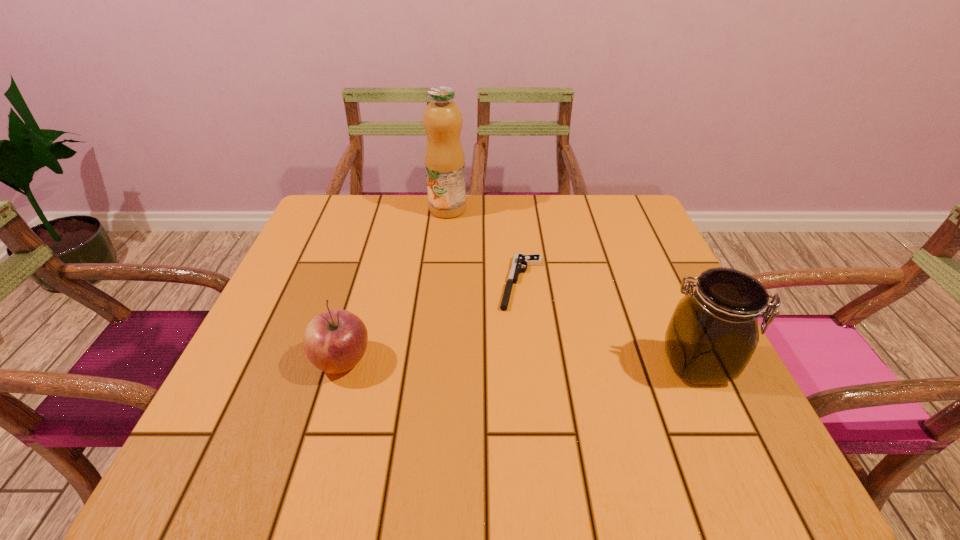
Identify the location of free space located 0.180m on the front label of the fruit juice. This screenshot has height=540, width=960. (457, 260).

I want to click on vacant space located 0.070m on the front label of the fruit juice, so click(452, 234).

Find the location of a particular element. The image size is (960, 540). free space located on the front-facing side of the third nearest object is located at coordinates (514, 342).

Find the location of `vacant point located 0.180m on the front-facing side of the third nearest object`. vacant point located 0.180m on the front-facing side of the third nearest object is located at coordinates (506, 379).

I want to click on vacant space positioned 0.140m on the front-facing side of the third nearest object, so [x=510, y=362].

Identify the location of object that is at the far edge. (442, 119).

This screenshot has width=960, height=540. Identify the location of apple that is at the near edge. (334, 341).

Where is `jar at the near edge`? jar at the near edge is located at coordinates (713, 333).

Where is `object present at the left edge`? The width and height of the screenshot is (960, 540). object present at the left edge is located at coordinates (334, 341).

Locate an element on the screen. The height and width of the screenshot is (540, 960). object that is at the right edge is located at coordinates (713, 333).